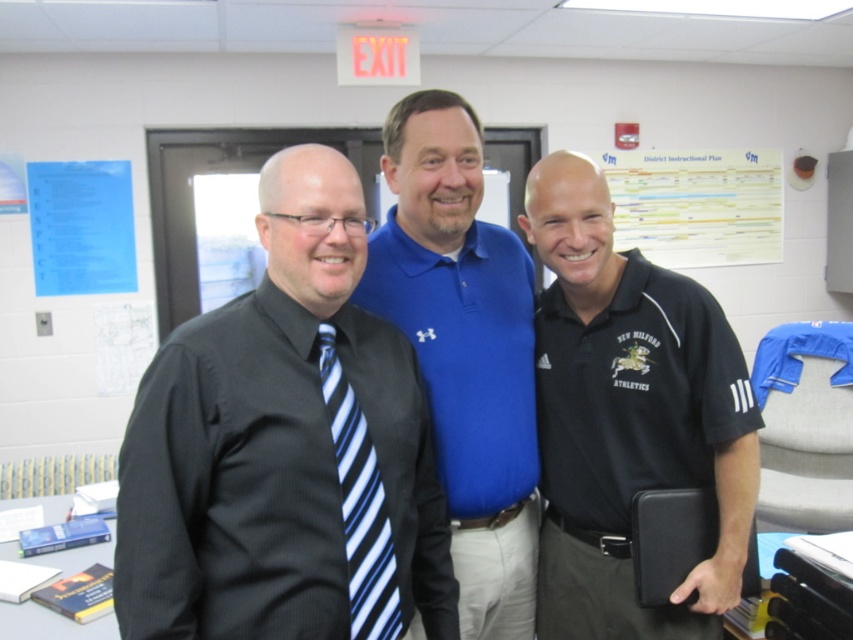
Question: Which point is closer to the camera taking this photo?

Choices:
 (A) (419, 252)
 (B) (415, 483)

Answer: (B)

Question: Does blue cotton polo shirt at center have a greater width compared to blue striped tie at left?

Choices:
 (A) yes
 (B) no

Answer: (A)

Question: Which point is closer to the camera?

Choices:
 (A) white paper at upper center
 (B) blue cotton polo shirt at center

Answer: (B)

Question: Does black matte polo shirt at center have a greater width compared to blue cotton polo shirt at center?

Choices:
 (A) no
 (B) yes

Answer: (B)

Question: Estimate the real-world distances between objects in this image. Which object is farther from the white paper at upper center?

Choices:
 (A) black smooth shirt at left
 (B) black matte polo shirt at center

Answer: (A)

Question: Can you confirm if blue cotton polo shirt at center is wider than blue striped tie at left?

Choices:
 (A) no
 (B) yes

Answer: (B)